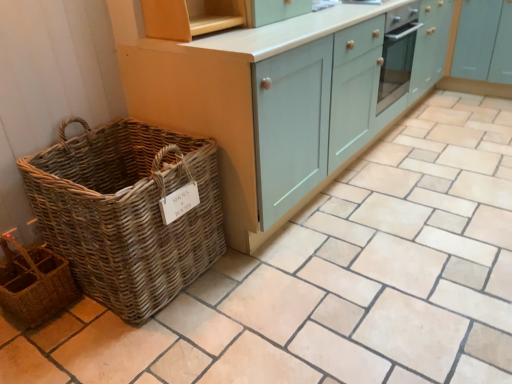
Where is `vacant space in between woven brown basket at left and matte teal cabinet at center, which is counted as the first cabinetry, starting from the left`? This screenshot has height=384, width=512. vacant space in between woven brown basket at left and matte teal cabinet at center, which is counted as the first cabinetry, starting from the left is located at coordinates (220, 283).